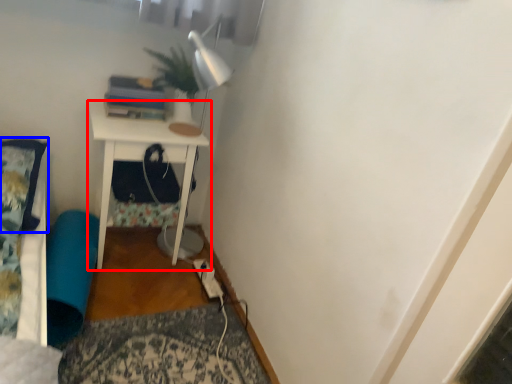
Question: Which point is closer to the camera, nightstand (highlighted by a red box) or pillow (highlighted by a blue box)?

Choices:
 (A) nightstand
 (B) pillow

Answer: (B)